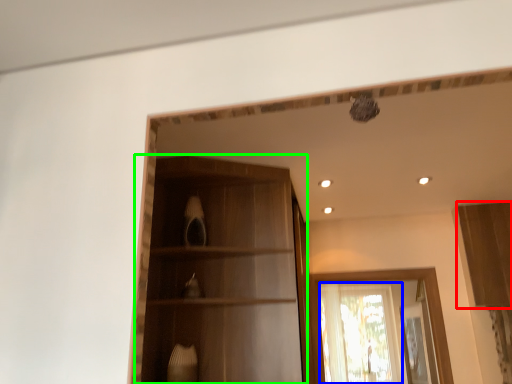
Question: Which is nearer to the cabinetry (highlighted by a red box)? window (highlighted by a blue box) or cabinetry (highlighted by a green box).

Choices:
 (A) window
 (B) cabinetry

Answer: (A)